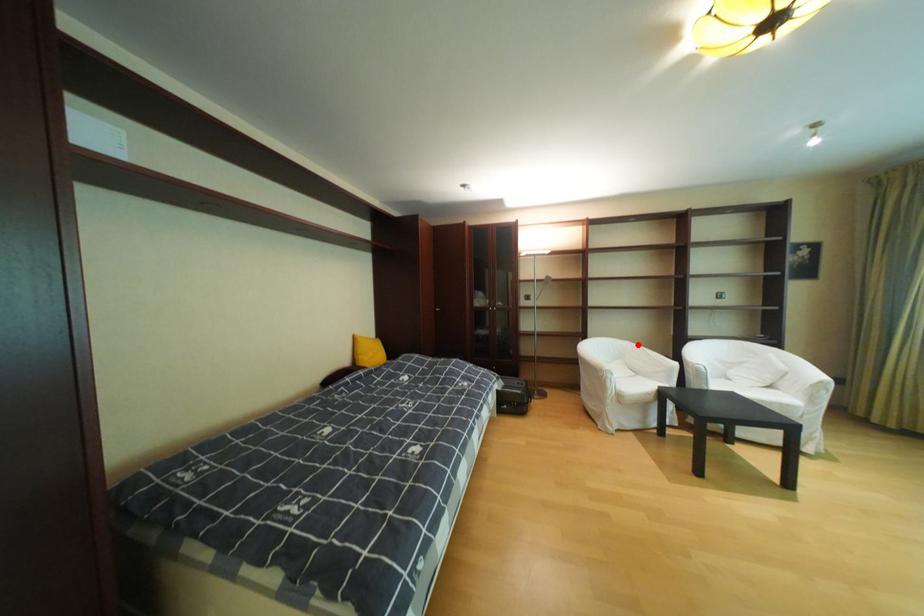
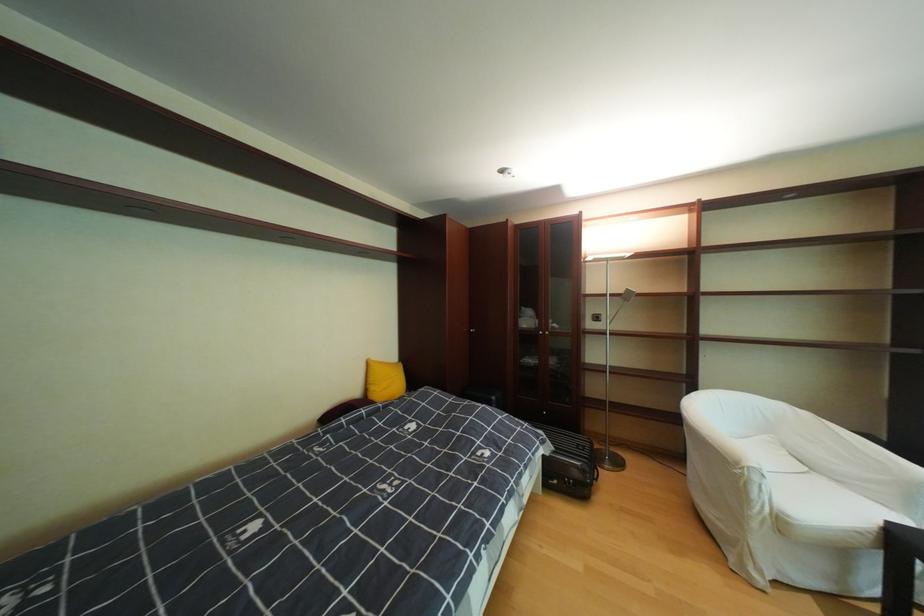
Question: I am providing you with two images of the same scene from different viewpoints. A red point is marked on the first image. Is the red point's position out of view in image 2?

Choices:
 (A) Yes
 (B) No

Answer: (B)